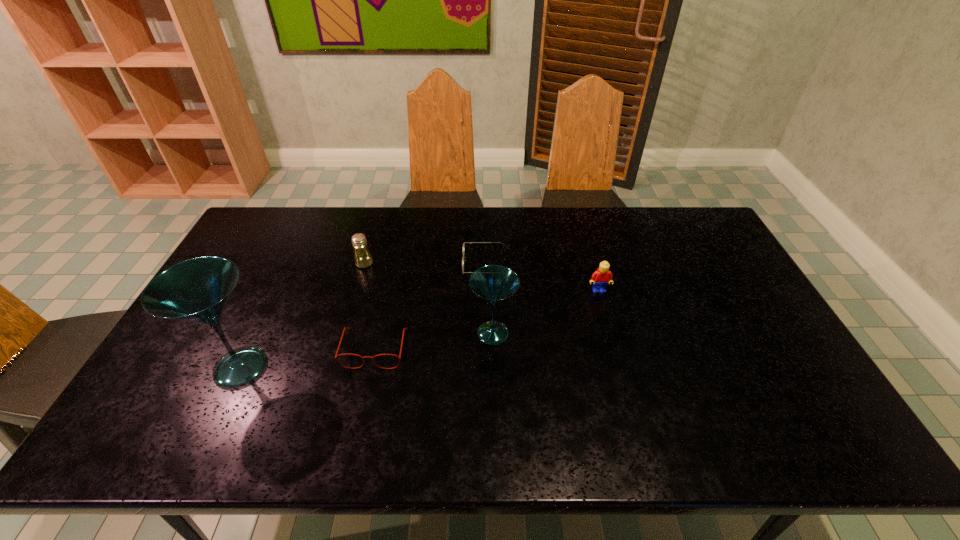
Where is `the leftmost object`? the leftmost object is located at coordinates (197, 290).

Find the location of `the taller martini`. the taller martini is located at coordinates (197, 290).

Locate an element on the screen. The image size is (960, 540). the second tallest object is located at coordinates (493, 283).

Image resolution: width=960 pixels, height=540 pixels. What are the coordinates of `the shorter martini` in the screenshot? It's located at (493, 283).

Find the location of `saltshaker`. saltshaker is located at coordinates (362, 256).

I want to click on the rightmost object, so tap(600, 278).

Image resolution: width=960 pixels, height=540 pixels. I want to click on Lego, so click(600, 278).

You are a GUI agent. You are given a task and a screenshot of the screen. Output one action in this format:
    pyautogui.click(x=<x>, y=<y>)
    Task: Click on the shortest object
    This screenshot has height=540, width=960.
    Given the screenshot: What is the action you would take?
    pyautogui.click(x=463, y=258)

Locate an element on the screen. spectacles is located at coordinates (336, 356).

This screenshot has height=540, width=960. I want to click on free region located on the left of the taller martini, so click(x=162, y=368).